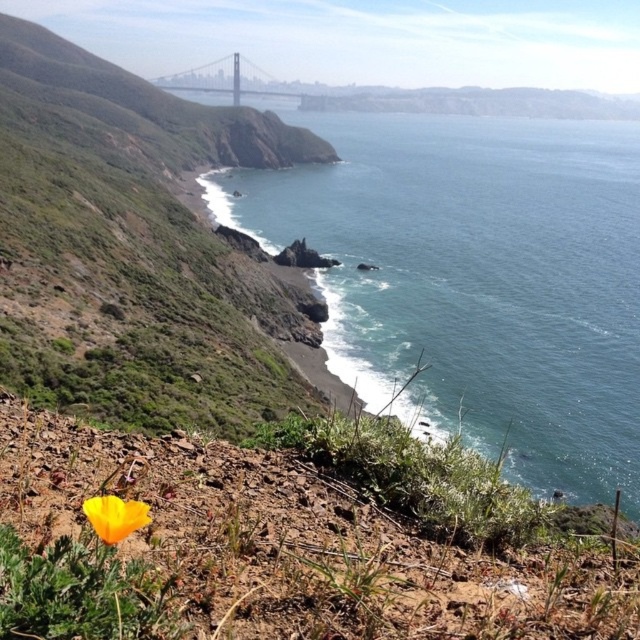
Can you confirm if blue water at lower right is positioned to the right of green grassy hillside at upper left?

Correct, you'll find blue water at lower right to the right of green grassy hillside at upper left.

Who is more forward, (464, 266) or (208, 301)?

Positioned in front is point (208, 301).

Who is more distant from viewer, [356,333] or [16,288]?

Point [356,333]

I want to click on blue water at lower right, so click(x=476, y=280).

Can you confirm if green grassy hillside at upper left is smaller than yellow matte flower at lower left?

No.

Can you confirm if green grassy hillside at upper left is positioned to the left of yellow matte flower at lower left?

Correct, you'll find green grassy hillside at upper left to the left of yellow matte flower at lower left.

Does point (148, 420) come behind point (122, 536)?

Yes.

Where is `green grassy hillside at upper left`? green grassy hillside at upper left is located at coordinates (136, 248).

Who is lower down, blue water at lower right or metallic gray bridge at center?

blue water at lower right is below.

Who is positioned more to the left, blue water at lower right or metallic gray bridge at center?

Positioned to the left is metallic gray bridge at center.

Where is `blue water at lower right`? blue water at lower right is located at coordinates point(476,280).